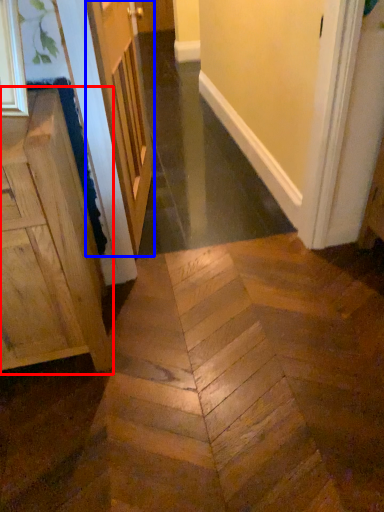
Question: Which point is closer to the camera, cabinetry (highlighted by a red box) or door (highlighted by a blue box)?

Choices:
 (A) cabinetry
 (B) door

Answer: (A)